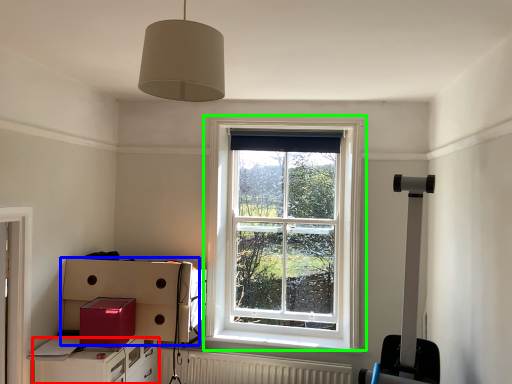
Question: Estimate the real-world distances between objects in this image. Which object is farther from cabinetry (highlighted by a red box), cardboard box (highlighted by a blue box) or window (highlighted by a green box)?

Choices:
 (A) cardboard box
 (B) window

Answer: (B)